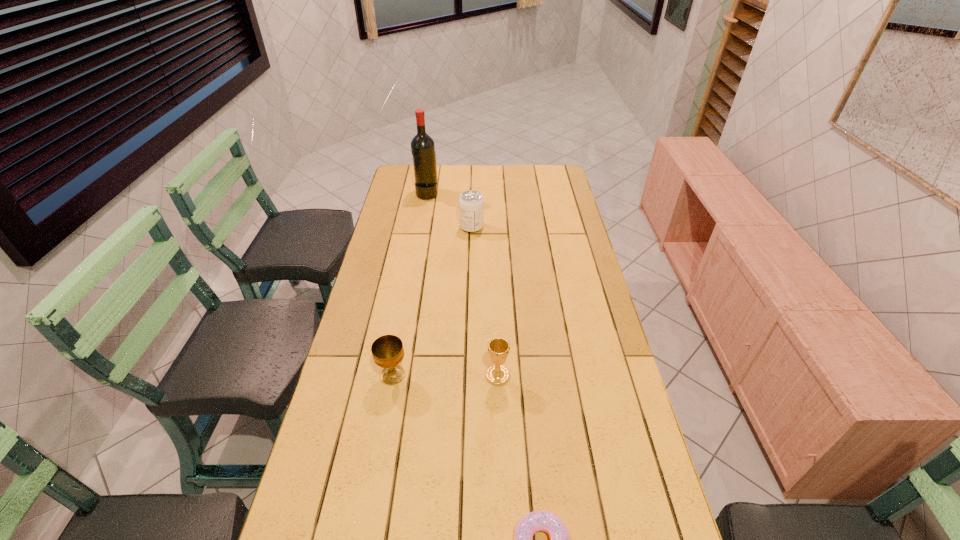
Where is `unoccupied area between the left chalice and the soda can`? unoccupied area between the left chalice and the soda can is located at coordinates (432, 301).

Locate an element on the screen. free space between the right chalice and the wine bottle is located at coordinates (463, 285).

I want to click on vacant space in between the right chalice and the farthest object, so click(x=463, y=285).

The image size is (960, 540). Find the location of `vacant area that lies between the tallest object and the right chalice`. vacant area that lies between the tallest object and the right chalice is located at coordinates (463, 285).

This screenshot has height=540, width=960. I want to click on empty space between the farthest object and the third object from left to right, so click(x=449, y=211).

The height and width of the screenshot is (540, 960). Identify the location of empty location between the tallest object and the third object from right to left. (449, 211).

At what (x,y) coordinates should I click in order to perform the action: click on vacant region between the second farthest object and the right chalice. Please return your answer as a coordinate pair (x, y). This screenshot has width=960, height=540. Looking at the image, I should click on (485, 301).

Identify which object is the third nearest to the farthest object. Please provide its 2D coordinates. Your answer should be formatted as a tuple, i.e. [(x, y)], where the tuple contains the x and y coordinates of a point satisfying the conditions above.

[(498, 348)]

Where is `the fourth closest object to the wine bottle`? Image resolution: width=960 pixels, height=540 pixels. the fourth closest object to the wine bottle is located at coordinates (552, 524).